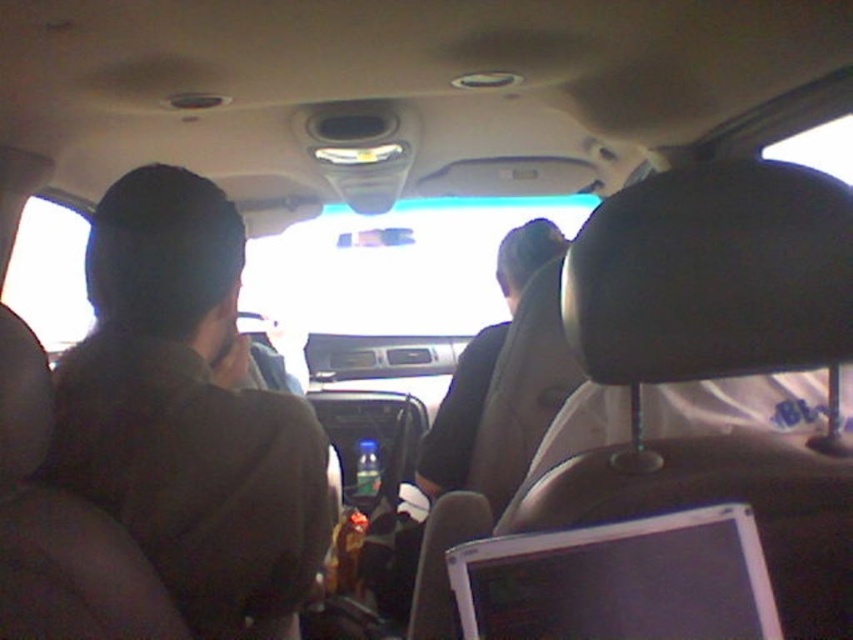
Does dark brown fabric at left appear over black fabric shirt at center?

No.

Is point (279, 568) positioned before point (525, 259)?

Yes, point (279, 568) is closer to viewer.

Image resolution: width=853 pixels, height=640 pixels. I want to click on dark brown fabric at left, so click(189, 412).

You are a GUI agent. You are given a task and a screenshot of the screen. Output one action in this format:
    pyautogui.click(x=<x>, y=<y>)
    Task: Click on the dark brown fabric at left
    
    Given the screenshot: What is the action you would take?
    pyautogui.click(x=189, y=412)

Is point (637, 544) more distant than point (502, 243)?

No, (637, 544) is closer to viewer.

Can you confirm if silver plastic laptop at lower right is positioned to the right of black fabric shirt at center?

Indeed, silver plastic laptop at lower right is positioned on the right side of black fabric shirt at center.

Does point (607, 589) lie in front of point (448, 406)?

Yes, it is.

The image size is (853, 640). I want to click on silver plastic laptop at lower right, so click(x=619, y=580).

Is point (93, 307) in front of point (724, 625)?

No, (93, 307) is further to viewer.

Which is in front, point (107, 483) or point (665, 605)?

Point (665, 605) is more forward.

Between point (291, 593) and point (686, 600), which one is positioned in front?

Point (686, 600) is in front.

Identify the location of dark brown fabric at left. This screenshot has width=853, height=640. (189, 412).